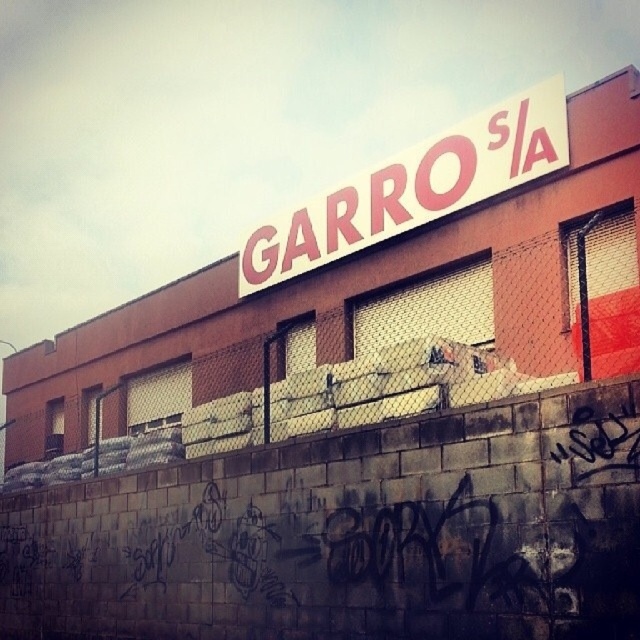
You are a delivery person trying to see the white matte sign at upper center clearly. There is a metal mesh fence at upper center in the way. Can you tell if the fence is wider than the sign?

The metal mesh fence at upper center might be wider than white matte sign at upper center, so it could block your view of the sign depending on the angle and distance.

You are a delivery person trying to see the white matte sign at upper center from the street. There is a metal mesh fence at upper center in your way. Can you see the sign over the fence?

The metal mesh fence at upper center is much taller than the white matte sign at upper center, so the fence would block your view of the sign.

You are a delivery person trying to access the building entrance located between the metal mesh fence at upper center and the white matte sign at upper center. Can your 1.8 meter wide delivery truck fit through the space between them?

The metal mesh fence at upper center and white matte sign at upper center are 3.70 meters apart from each other. Since the truck is 1.8 meters wide, it can fit through the space between them as the distance is wider than the truck.